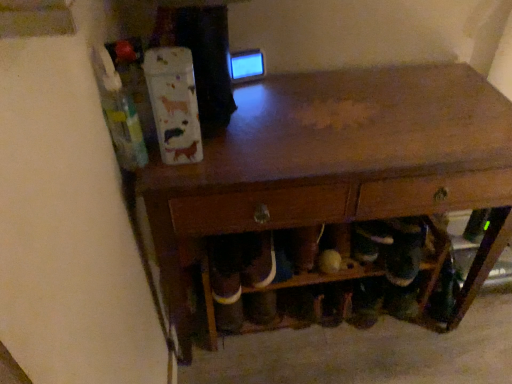
Question: In terms of height, does wooden table at center look taller or shorter compared to wooden shoe rack at lower center?

Choices:
 (A) short
 (B) tall

Answer: (B)

Question: From the image's perspective, is wooden table at center above or below wooden shoe rack at lower center?

Choices:
 (A) above
 (B) below

Answer: (A)

Question: Visually, is wooden table at center positioned to the left or to the right of wooden shoe rack at lower center?

Choices:
 (A) left
 (B) right

Answer: (B)

Question: In terms of height, does wooden shoe rack at lower center look taller or shorter compared to wooden table at center?

Choices:
 (A) tall
 (B) short

Answer: (B)

Question: Is wooden shoe rack at lower center wider or thinner than wooden table at center?

Choices:
 (A) thin
 (B) wide

Answer: (A)

Question: Looking at the image, does wooden shoe rack at lower center seem bigger or smaller compared to wooden table at center?

Choices:
 (A) small
 (B) big

Answer: (A)

Question: Considering the positions of point (250, 288) and point (481, 142), is point (250, 288) closer or farther from the camera than point (481, 142)?

Choices:
 (A) farther
 (B) closer

Answer: (A)